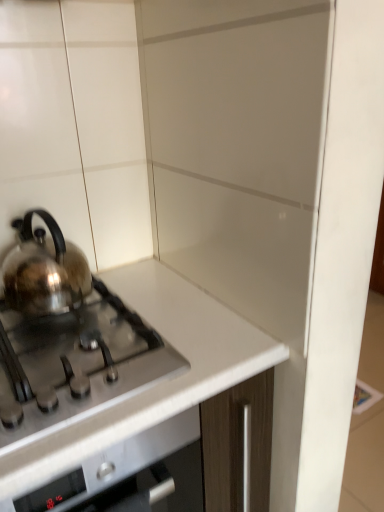
Question: Is satin silver kettle at left bigger than white glossy countertop at center?

Choices:
 (A) yes
 (B) no

Answer: (B)

Question: Considering the relative sizes of satin silver kettle at left and white glossy countertop at center in the image provided, is satin silver kettle at left wider than white glossy countertop at center?

Choices:
 (A) no
 (B) yes

Answer: (A)

Question: From a real-world perspective, is satin silver kettle at left on white glossy countertop at center?

Choices:
 (A) no
 (B) yes

Answer: (B)

Question: Is satin silver kettle at left not near white glossy countertop at center?

Choices:
 (A) yes
 (B) no

Answer: (B)

Question: From the image's perspective, is satin silver kettle at left above white glossy countertop at center?

Choices:
 (A) no
 (B) yes

Answer: (B)

Question: Is satin silver kettle at left to the left of white glossy countertop at center from the viewer's perspective?

Choices:
 (A) no
 (B) yes

Answer: (B)

Question: Is satin silver gas stove at left not near satin silver kettle at left?

Choices:
 (A) no
 (B) yes

Answer: (A)

Question: Is satin silver kettle at left at the back of satin silver gas stove at left?

Choices:
 (A) yes
 (B) no

Answer: (B)

Question: Could satin silver kettle at left be considered to be inside satin silver gas stove at left?

Choices:
 (A) no
 (B) yes

Answer: (A)

Question: Is satin silver gas stove at left wider than satin silver kettle at left?

Choices:
 (A) yes
 (B) no

Answer: (A)

Question: Is satin silver gas stove at left to the left of satin silver kettle at left from the viewer's perspective?

Choices:
 (A) no
 (B) yes

Answer: (A)

Question: Is satin silver gas stove at left behind satin silver kettle at left?

Choices:
 (A) no
 (B) yes

Answer: (A)

Question: From a real-world perspective, is white glossy countertop at center positioned over satin silver gas stove at left based on gravity?

Choices:
 (A) no
 (B) yes

Answer: (A)